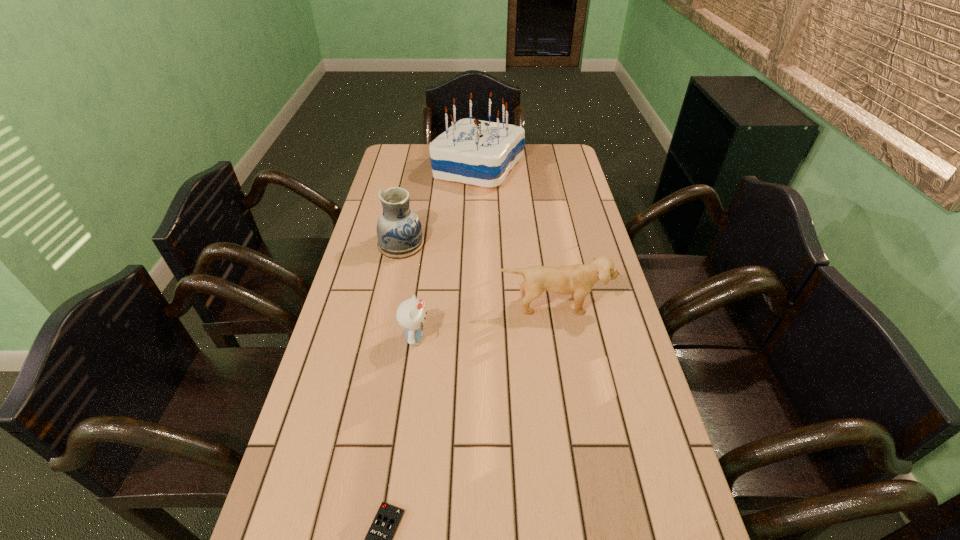
Identify which object is the fourth nearest to the farthest object. Please provide its 2D coordinates. Your answer should be formatted as a tuple, i.e. [(x, y)], where the tuple contains the x and y coordinates of a point satisfying the conditions above.

[(379, 538)]

In order to click on vacant space that satisfies the following two spatial constraints: 1. on the left side of the third shortest object; 2. on the front-facing side of the kitten in this screenshot , I will do `click(560, 338)`.

Locate an element on the screen. vacant area in the image that satisfies the following two spatial constraints: 1. on the back side of the second farthest object; 2. on the right side of the birthday cake is located at coordinates (417, 168).

Locate an element on the screen. This screenshot has height=540, width=960. free space in the image that satisfies the following two spatial constraints: 1. on the left side of the third shortest object; 2. on the front-facing side of the kitten is located at coordinates (560, 338).